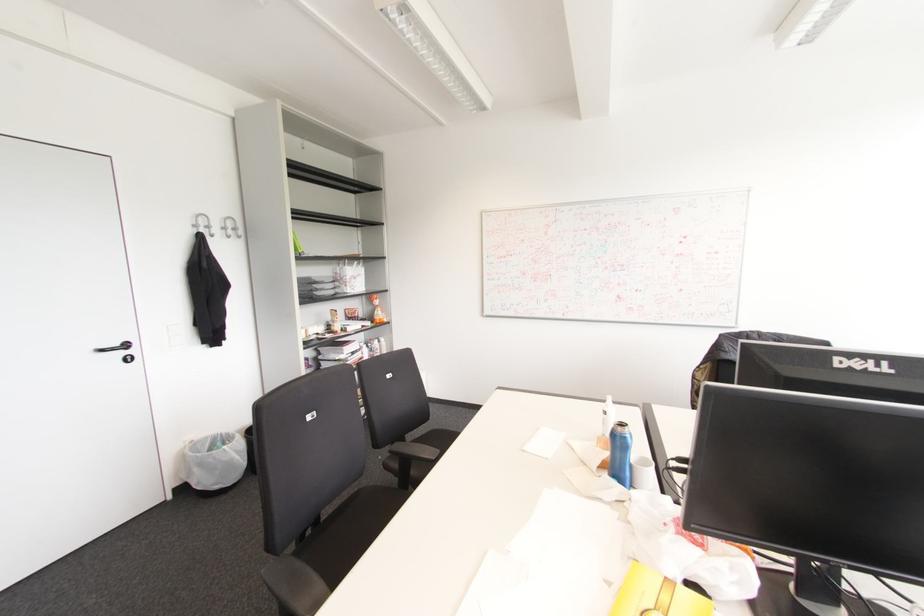
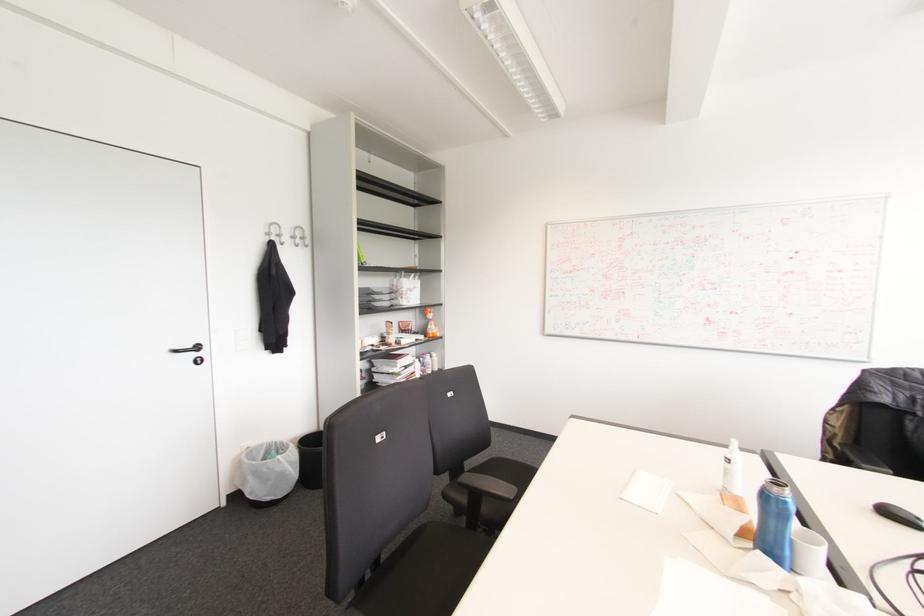
Locate, in the second image, the point that corresponds to the point at 630,466 in the first image.

(792, 541)